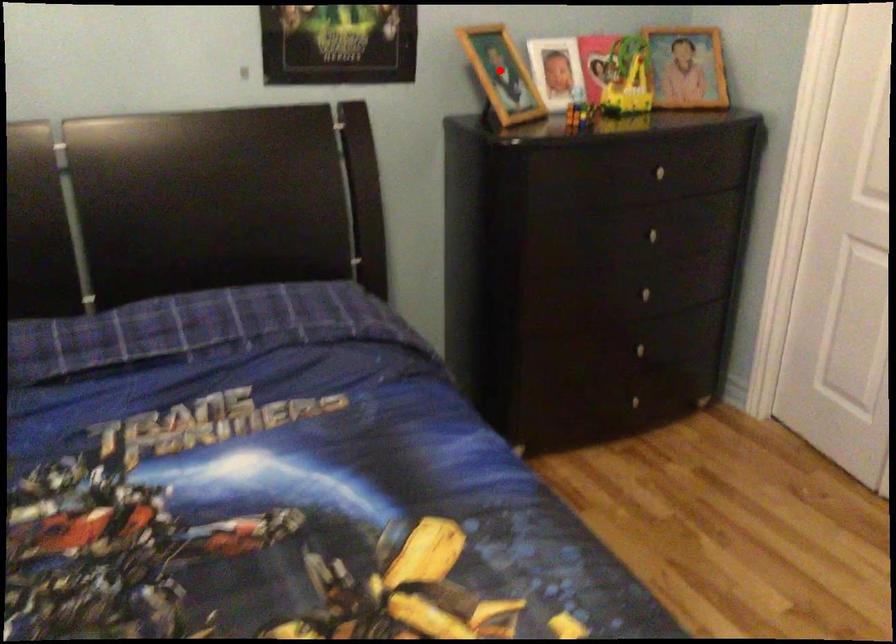
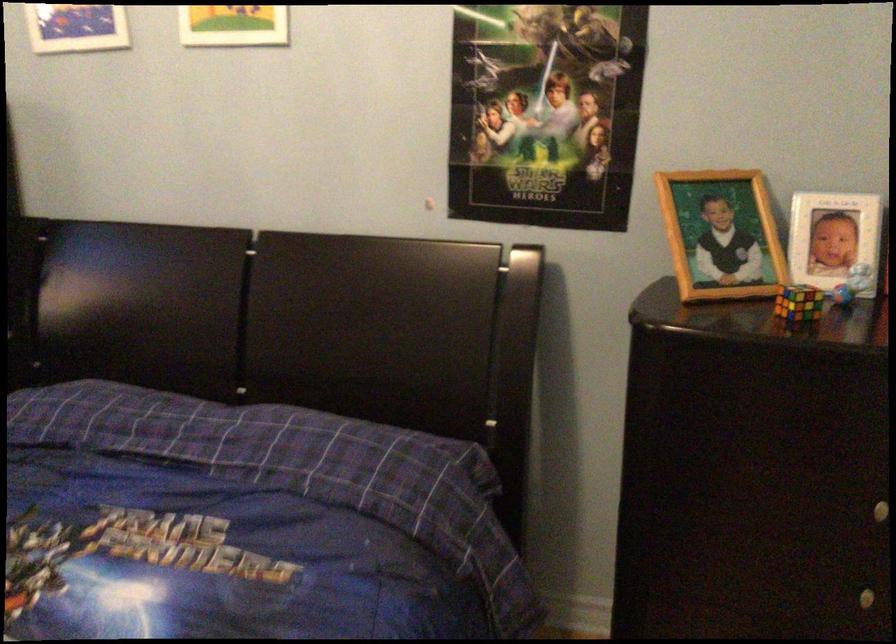
Question: I am providing you with two images of the same scene from different viewpoints. Image1 has a red point marked. In image2, the corresponding 3D location appears at what relative position? Reply with the corresponding letter.

Choices:
 (A) Closer
 (B) Farther

Answer: (A)